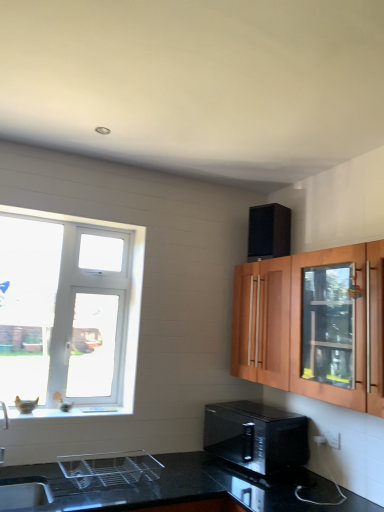
Question: Should I look upward or downward to see wooden cabinet with glass door at upper right?

Choices:
 (A) down
 (B) up

Answer: (A)

Question: Considering the relative sizes of wooden cabinet with glass door at upper right and black glossy microwave at lower center in the image provided, is wooden cabinet with glass door at upper right taller than black glossy microwave at lower center?

Choices:
 (A) no
 (B) yes

Answer: (B)

Question: From a real-world perspective, is wooden cabinet with glass door at upper right positioned under black glossy microwave at lower center based on gravity?

Choices:
 (A) no
 (B) yes

Answer: (A)

Question: Could black glossy microwave at lower center be considered to be inside wooden cabinet with glass door at upper right?

Choices:
 (A) no
 (B) yes

Answer: (A)

Question: From the image's perspective, is wooden cabinet with glass door at upper right located beneath black glossy microwave at lower center?

Choices:
 (A) no
 (B) yes

Answer: (A)

Question: Is wooden cabinet with glass door at upper right to the right of black glossy microwave at lower center from the viewer's perspective?

Choices:
 (A) yes
 (B) no

Answer: (A)

Question: Would you consider wooden cabinet with glass door at upper right to be distant from black glossy microwave at lower center?

Choices:
 (A) yes
 (B) no

Answer: (B)

Question: Considering the relative positions of black textured speaker at upper right, the first appliance positioned from the top, and white plastic window at left in the image provided, is black textured speaker at upper right, the first appliance positioned from the top, to the left of white plastic window at left from the viewer's perspective?

Choices:
 (A) yes
 (B) no

Answer: (B)

Question: Does black textured speaker at upper right, the first appliance positioned from the top, lie behind white plastic window at left?

Choices:
 (A) no
 (B) yes

Answer: (B)

Question: From a real-world perspective, is black textured speaker at upper right, the 2th appliance positioned from the front, physically above white plastic window at left?

Choices:
 (A) yes
 (B) no

Answer: (A)

Question: From a real-world perspective, is black textured speaker at upper right, the 1th appliance from the right, beneath white plastic window at left?

Choices:
 (A) no
 (B) yes

Answer: (A)

Question: Does black textured speaker at upper right, the 2th appliance positioned from the front, turn towards white plastic window at left?

Choices:
 (A) yes
 (B) no

Answer: (B)

Question: Can you confirm if black textured speaker at upper right, which is counted as the second appliance, starting from the bottom, is taller than white plastic window at left?

Choices:
 (A) yes
 (B) no

Answer: (B)

Question: From a real-world perspective, does black glossy microwave at lower center sit lower than white glossy window sill at lower left?

Choices:
 (A) yes
 (B) no

Answer: (A)